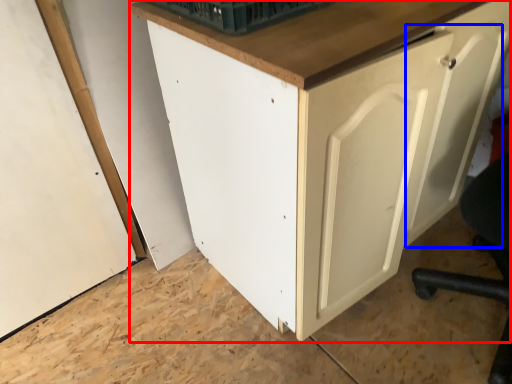
Question: Which object is closer to the camera taking this photo, cabinetry (highlighted by a red box) or door (highlighted by a blue box)?

Choices:
 (A) cabinetry
 (B) door

Answer: (A)